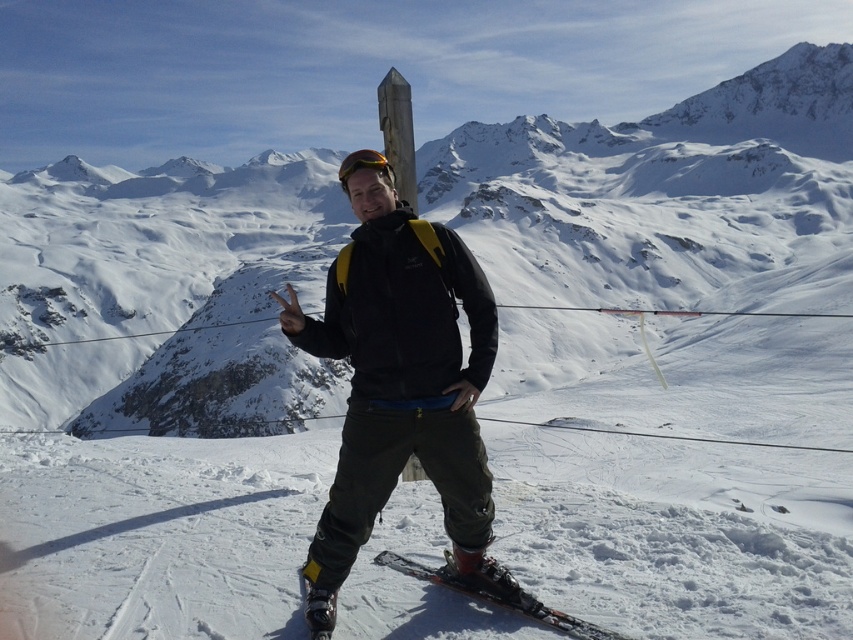
You are standing at the bottom of the mountain slope and want to reach the point marked at coordinates point (117,250). If your maximum comfortable walking distance is 200 meters, will you be able to reach it without feeling too tired?

The point (117,250) is 208.80 meters away from the viewer, which exceeds your maximum comfortable walking distance of 200 meters. Therefore, you may feel tired before reaching it.

You are planning to take a photo of the snowy mountain at center and the black matte jacket at center. Which object should you zoom in on to capture more details of the smaller one?

The black matte jacket at center is smaller than the snowy mountain at center, so you should zoom in on the black matte jacket at center to capture more details of the smaller one.

You are a photographer trying to capture the person in the image. You want to ensure both the black matte jacket at center and the shiny black ski at lower center are clearly visible in your shot. Considering their sizes, which object should you focus on first to ensure proper framing?

The black matte jacket at center is much taller than the shiny black ski at lower center, so you should focus on the black matte jacket at center first to ensure proper framing.